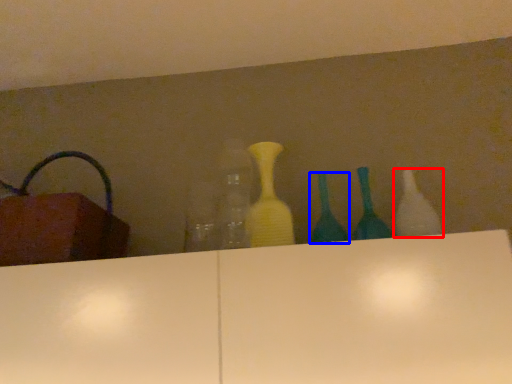
Question: Which of the following is the closest to the observer, bottle (highlighted by a red box) or bottle (highlighted by a blue box)?

Choices:
 (A) bottle
 (B) bottle

Answer: (A)